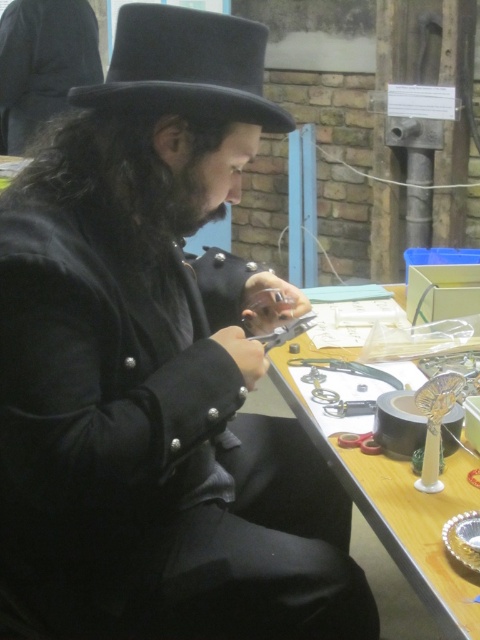
Question: Which point appears farthest from the camera in this image?

Choices:
 (A) (201, 19)
 (B) (0, 26)
 (C) (478, 612)

Answer: (B)

Question: Is wooden table at center to the right of black matte hat at upper left from the viewer's perspective?

Choices:
 (A) yes
 (B) no

Answer: (A)

Question: Is black felt dress hat at upper center bigger than black matte hat at upper left?

Choices:
 (A) no
 (B) yes

Answer: (A)

Question: Which object is closer to the camera taking this photo?

Choices:
 (A) black matte hat at upper left
 (B) wooden table at center
 (C) black felt dress hat at upper center

Answer: (B)

Question: Is black felt dress hat at upper center below black matte hat at upper left?

Choices:
 (A) no
 (B) yes

Answer: (B)

Question: Based on their relative distances, which object is nearer to the black felt dress hat at upper center?

Choices:
 (A) wooden table at center
 (B) black matte hat at upper left

Answer: (A)